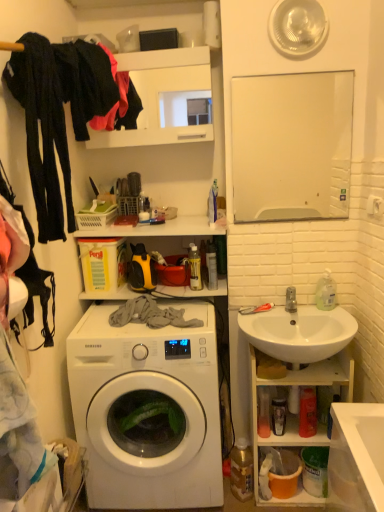
Find the location of a particular element. This screenshot has width=384, height=512. empty space that is ontop of white glossy washing machine at center (from a real-world perspective) is located at coordinates click(x=151, y=321).